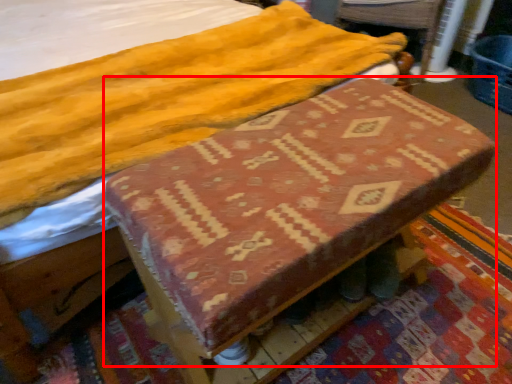
Question: From the image's perspective, where is changing table (annotated by the red box) located relative to swivel chair?

Choices:
 (A) below
 (B) above

Answer: (A)